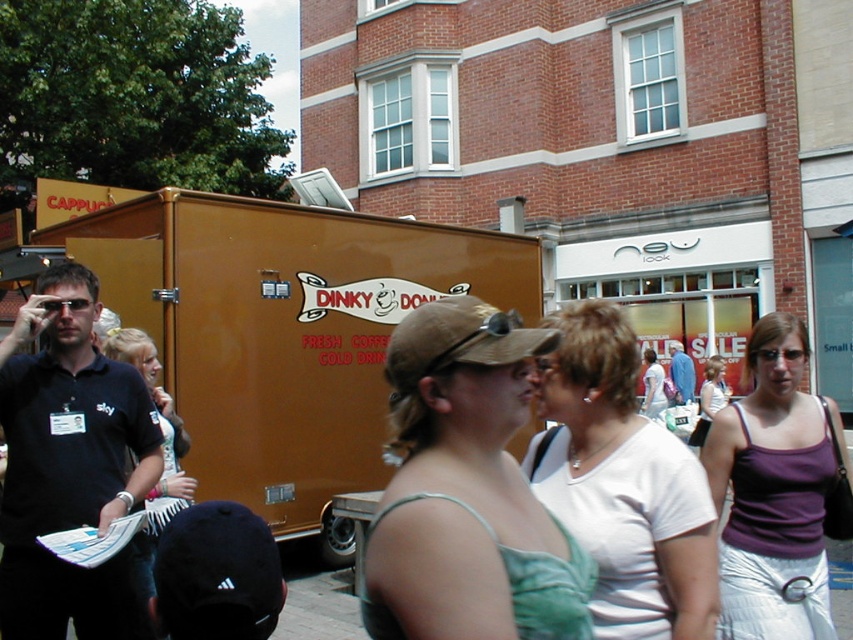
You are a photographer trying to capture a candid shot of the white cotton shirt at center and the white fabric scarf at center. Which one is on the left side when you look at the scene?

The white fabric scarf at center is on the left side because the white cotton shirt at center is positioned on the right side of it.

You are standing at the entrance of the food truck and want to hand a flyer to the person wearing the white cotton shirt at center and the white fabric scarf at center. Since you can only approach one at a time, which one is closer to you?

The white cotton shirt at center and white fabric scarf at center are 7.23 feet apart from each other, so you need to determine which one is closer to your position at the entrance. However, the description does not specify their exact positions relative to the entrance, so it is unclear which is closer without additional information.